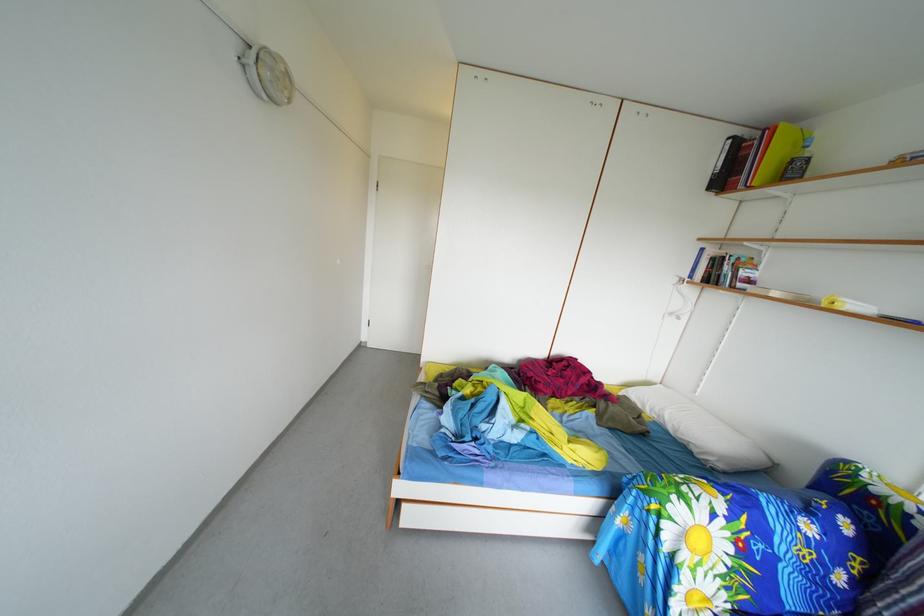
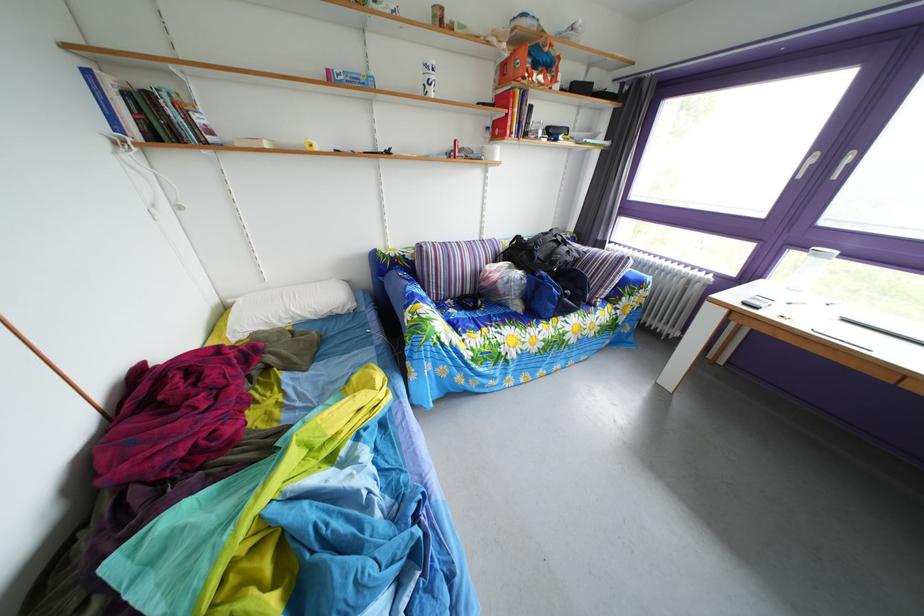
In the second image, find the point that corresponds to [810,513] in the first image.

(417, 290)